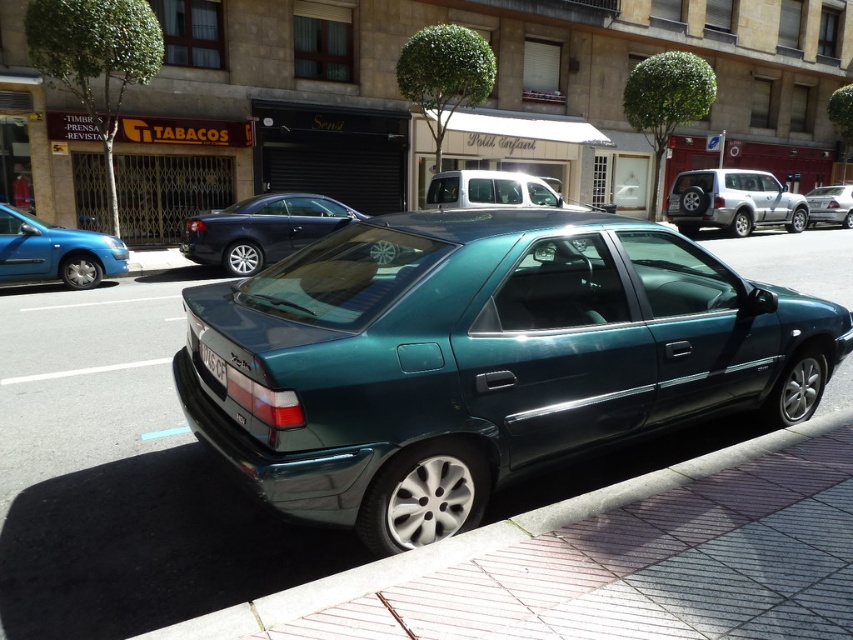
Is brick pavement at lower right positioned in front of shiny black car at center?

Yes.

Between brick pavement at lower right and shiny black car at center, which one appears on the right side from the viewer's perspective?

From the viewer's perspective, brick pavement at lower right appears more on the right side.

Where is `brick pavement at lower right`? This screenshot has height=640, width=853. brick pavement at lower right is located at coordinates (477, 540).

Identify the location of brick pavement at lower right. pyautogui.click(x=477, y=540).

Who is shorter, satin silver suv at right or metallic blue sedan at left?

Standing shorter between the two is satin silver suv at right.

How much distance is there between satin silver suv at right and metallic blue sedan at left?

satin silver suv at right and metallic blue sedan at left are 17.69 meters apart.

Is point (804, 202) more distant than point (62, 273)?

Yes, it is behind point (62, 273).

This screenshot has height=640, width=853. I want to click on satin silver suv at right, so click(x=733, y=202).

Between shiny black car at center and metallic blue sedan at left, which one appears on the right side from the viewer's perspective?

shiny black car at center is more to the right.

Is shiny black car at center to the right of metallic blue sedan at left from the viewer's perspective?

Correct, you'll find shiny black car at center to the right of metallic blue sedan at left.

Is point (312, 237) behind point (84, 262)?

Yes, it is.

What are the coordinates of `shiny black car at center` in the screenshot? It's located at (260, 228).